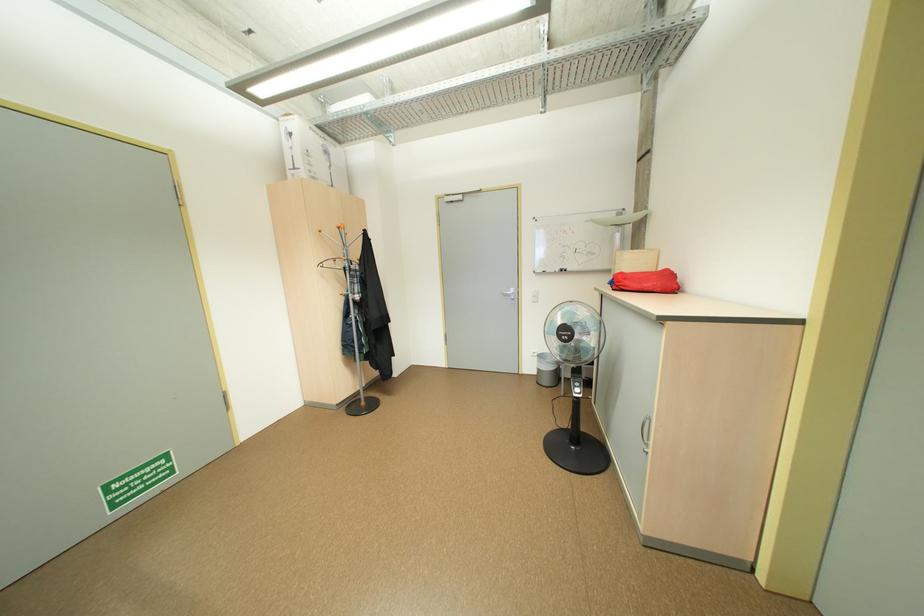
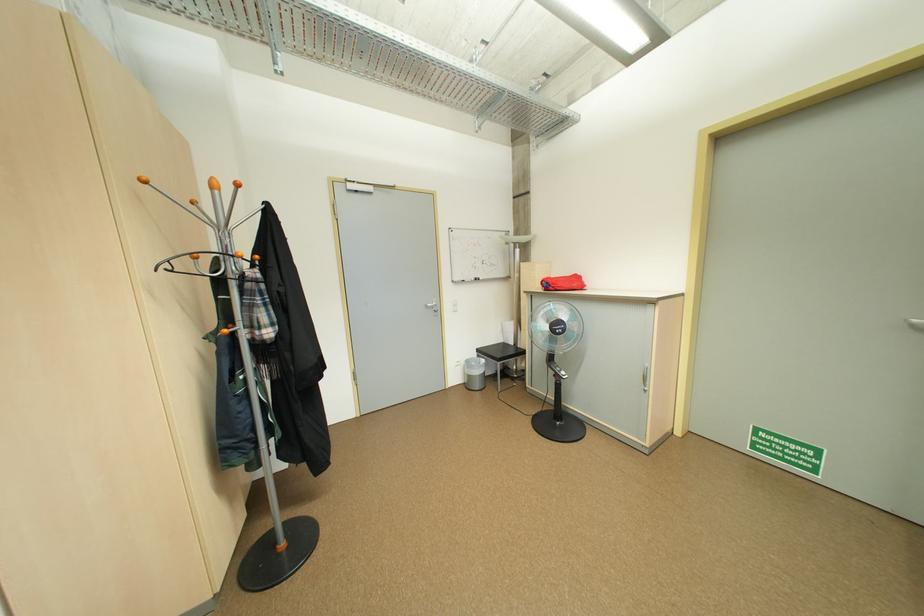
Locate, in the second image, the point that corresponds to (347,228) in the first image.

(247, 185)